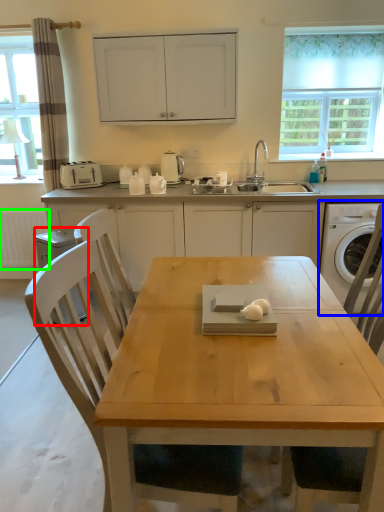
Question: Which object is the closest to the dish washer (highlighted by a red box)? Choose among these: washing machine (highlighted by a blue box) or radiator (highlighted by a green box).

Choices:
 (A) washing machine
 (B) radiator

Answer: (B)